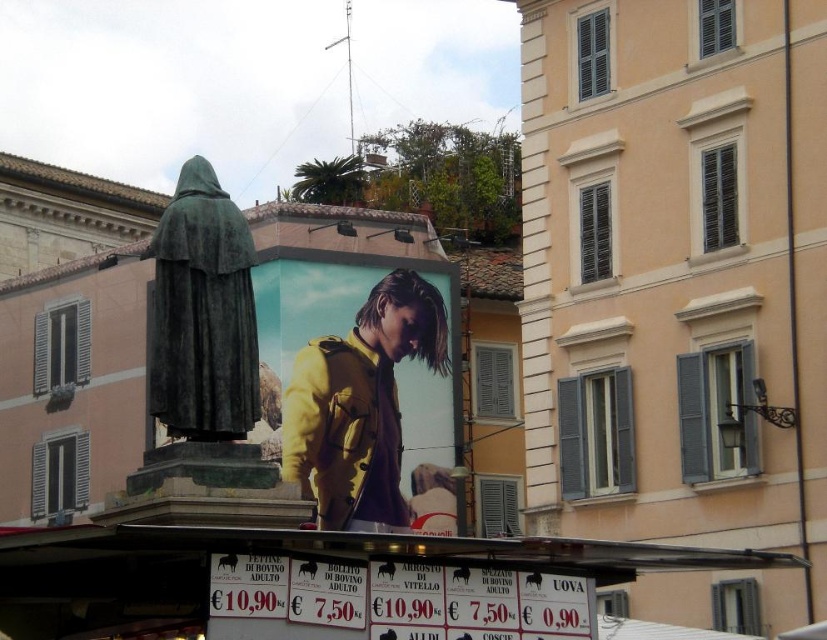
In the scene shown: Between yellow matte jacket at center and white paper signboard at lower center, which one has more height?

yellow matte jacket at center is taller.

Does point (352, 387) lie behind point (447, 600)?

That is True.

Who is more distant from viewer, (x=362, y=362) or (x=237, y=604)?

Positioned behind is point (x=362, y=362).

Find the location of a particular element. This screenshot has height=640, width=827. yellow matte jacket at center is located at coordinates (361, 404).

Which is more to the right, yellow matte jacket at center or green bronze statue at center?

From the viewer's perspective, yellow matte jacket at center appears more on the right side.

The height and width of the screenshot is (640, 827). I want to click on yellow matte jacket at center, so click(361, 404).

Which is more to the left, white paper signboard at lower center or green bronze statue at center?

Positioned to the left is green bronze statue at center.

Is white paper signboard at lower center closer to camera compared to green bronze statue at center?

That is True.

Between point (390, 634) and point (213, 417), which one is positioned in front?

Point (390, 634) is in front.

You are a GUI agent. You are given a task and a screenshot of the screen. Output one action in this format:
    pyautogui.click(x=<x>, y=<y>)
    Task: Click on the white paper signboard at lower center
    This screenshot has height=640, width=827.
    Given the screenshot: What is the action you would take?
    pyautogui.click(x=402, y=598)